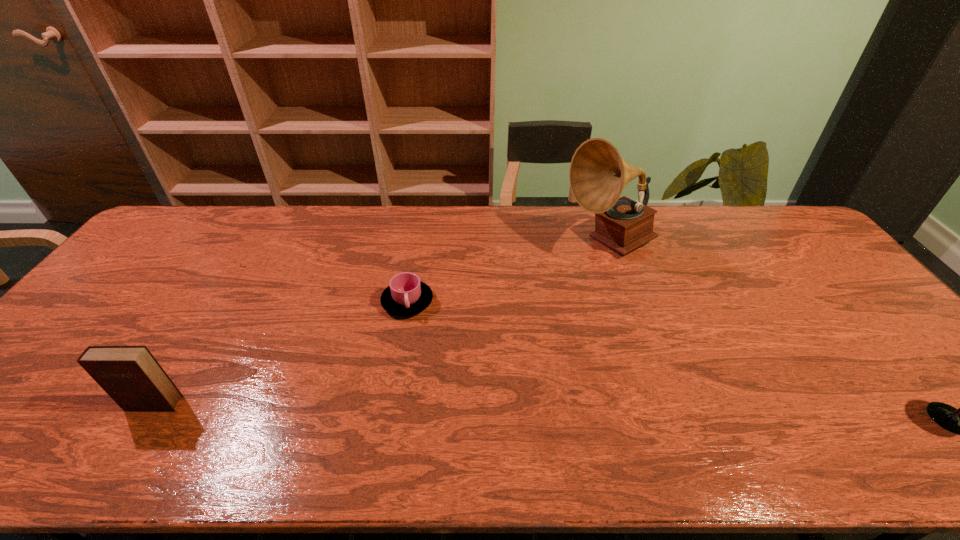
Identify the location of diary. (130, 375).

You are a GUI agent. You are given a task and a screenshot of the screen. Output one action in this format:
    pyautogui.click(x=<x>, y=<y>)
    Task: Click on the second farthest object
    This screenshot has height=540, width=960.
    Given the screenshot: What is the action you would take?
    pyautogui.click(x=406, y=295)

I want to click on the second object from left to right, so click(406, 295).

Locate an element on the screen. the farthest object is located at coordinates (598, 174).

Find the location of a particular element. The image size is (960, 540). the tallest object is located at coordinates (598, 174).

In order to click on blank space located on the side with the handle of the second object from left to right in this screenshot , I will do (428, 338).

Where is `free space located 0.340m on the side with the handle of the second object from left to right`? The width and height of the screenshot is (960, 540). free space located 0.340m on the side with the handle of the second object from left to right is located at coordinates (473, 418).

The width and height of the screenshot is (960, 540). Find the location of `vacant space located 0.310m on the side with the handle of the second object from left to right`. vacant space located 0.310m on the side with the handle of the second object from left to right is located at coordinates (467, 407).

In order to click on free spot located on the horn of the third object from left to right in this screenshot , I will do `click(588, 274)`.

Image resolution: width=960 pixels, height=540 pixels. What are the coordinates of `free spot located on the horn of the third object from left to right` in the screenshot? It's located at (546, 346).